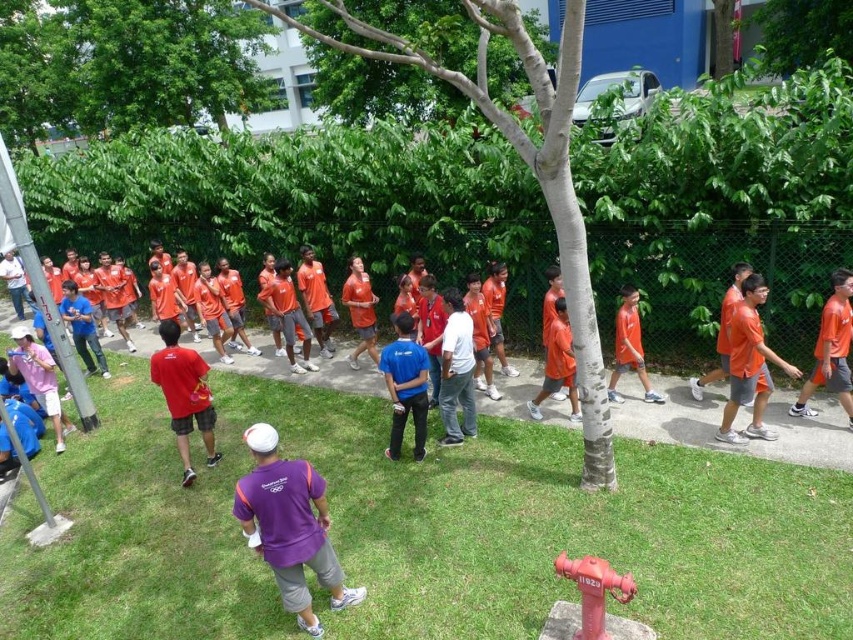
Question: Considering the real-world distances, which object is farthest from the matte blue shirt at center?

Choices:
 (A) red painted metal hydrant at lower center
 (B) purple fabric shirt at center
 (C) orange matte shirt at right
 (D) orange matte shirt at center

Answer: (C)

Question: Can you confirm if purple fabric shirt at center is positioned to the right of green leafy tree at upper center?

Choices:
 (A) yes
 (B) no

Answer: (B)

Question: Which point is closer to the camera?

Choices:
 (A) (401, 324)
 (B) (645, 372)
 (C) (827, 8)

Answer: (A)

Question: Among these points, which one is farthest from the camera?

Choices:
 (A) [404, 362]
 (B) [612, 369]
 (C) [440, 76]
 (D) [608, 582]

Answer: (B)

Question: Can you confirm if green leafy tree at upper center is thinner than matte blue shirt at center?

Choices:
 (A) no
 (B) yes

Answer: (A)

Question: Is green grass at lower center further to camera compared to green leafy tree at upper left?

Choices:
 (A) yes
 (B) no

Answer: (B)